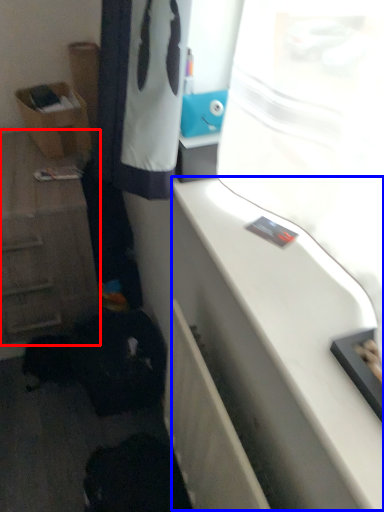
Question: Which of the following is the closest to the observer, cabinetry (highlighted by a red box) or counter top (highlighted by a blue box)?

Choices:
 (A) cabinetry
 (B) counter top

Answer: (B)